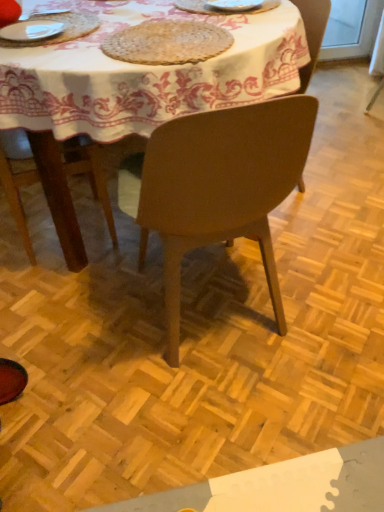
The height and width of the screenshot is (512, 384). I want to click on vacant space behind white glossy plate at upper left, so click(x=81, y=17).